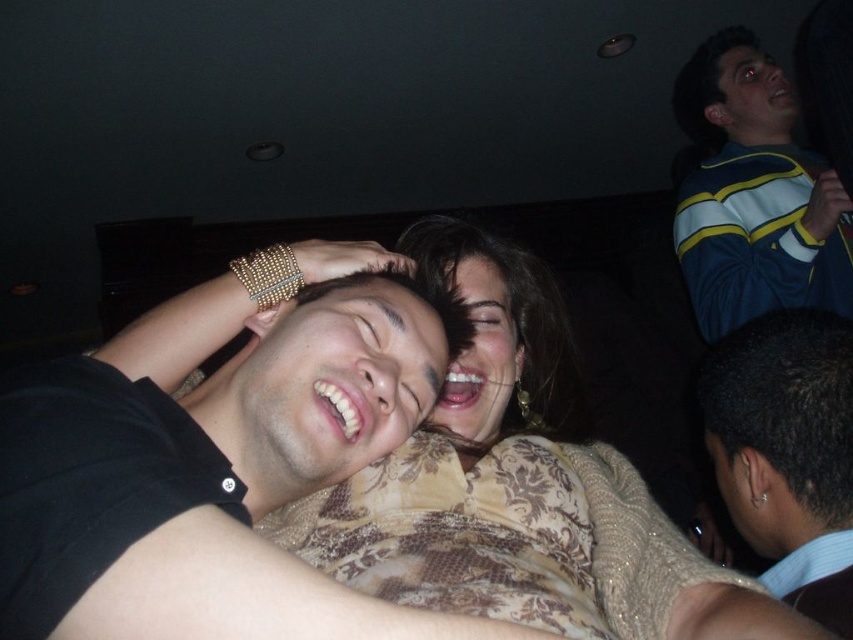
Question: Which of the following is the closest to the observer?

Choices:
 (A) (821, 257)
 (B) (293, 506)

Answer: (B)

Question: Which object is farther from the camera taking this photo?

Choices:
 (A) blue and yellow striped sweater at upper right
 (B) gold textured sweater at center
 (C) black leather jacket at lower right

Answer: (A)

Question: Does blue and yellow striped sweater at upper right appear over black leather jacket at lower right?

Choices:
 (A) yes
 (B) no

Answer: (A)

Question: Can you confirm if black shirt at center is thinner than blue and yellow striped sweater at upper right?

Choices:
 (A) yes
 (B) no

Answer: (A)

Question: Does gold textured sweater at center come behind blue and yellow striped sweater at upper right?

Choices:
 (A) yes
 (B) no

Answer: (B)

Question: Which object appears farthest from the camera in this image?

Choices:
 (A) blue and yellow striped sweater at upper right
 (B) black leather jacket at lower right

Answer: (A)